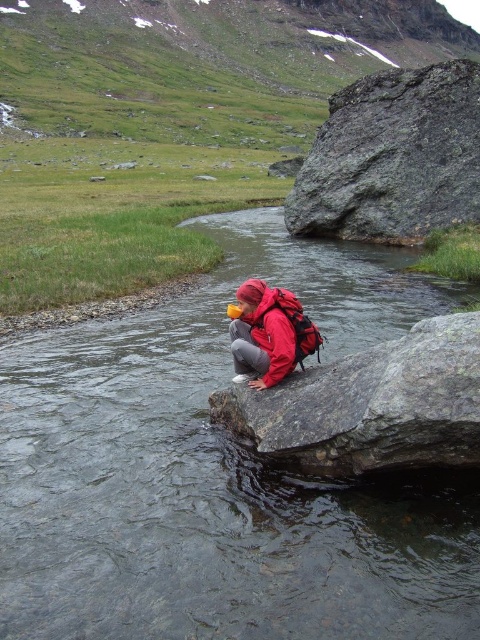
You are a photographer standing at the edge of the clear water stream at center. You want to capture a photo of the stream from exactly 40 feet away. Is the current distance sufficient for your needs?

The clear water stream at center is 37.55 feet from camera, which is slightly closer than the desired 40 feet. To achieve the desired distance, you would need to move back approximately 2.45 feet.

You are a hiker who wants to cross the stream. You see the clear water stream at center and the gray rough rock at upper right. Which object is taller? Please answer based on their heights.

The gray rough rock at upper right is taller than the clear water stream at center.